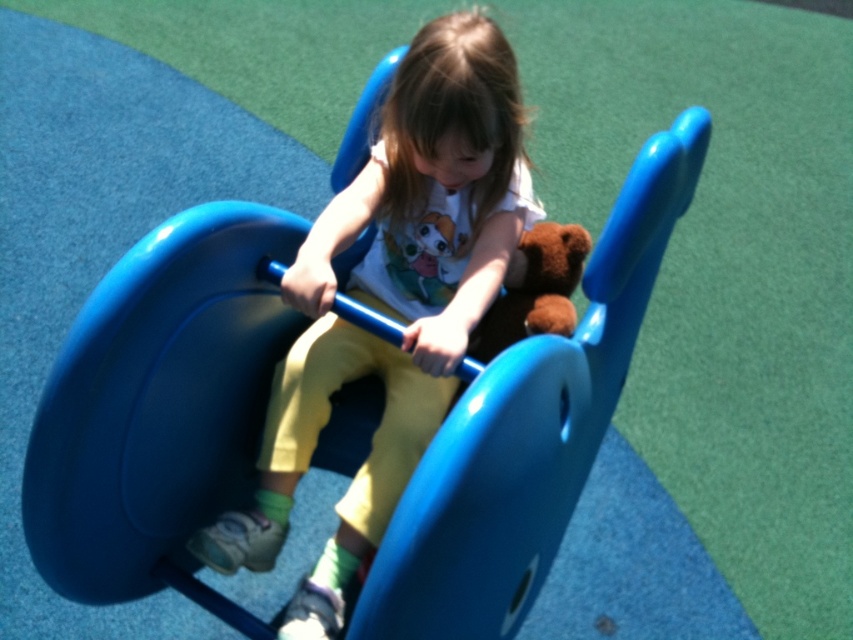
Between matte plastic child at center and brown plush at center, which one is positioned lower?

Positioned lower is matte plastic child at center.

Does matte plastic child at center appear under brown plush at center?

Yes.

Is point (368, 506) behind point (563, 248)?

No, (368, 506) is in front of (563, 248).

Find the location of a particular element. Image resolution: width=853 pixels, height=640 pixels. matte plastic child at center is located at coordinates (392, 300).

Between point (456, 616) and point (486, 145), which one is positioned in front?

Point (456, 616) is in front.

Can you confirm if blue glossy slide at center is positioned to the right of matte plastic child at center?

Yes, blue glossy slide at center is to the right of matte plastic child at center.

Which is behind, point (148, 579) or point (294, 602)?

Point (148, 579)

The width and height of the screenshot is (853, 640). I want to click on blue glossy slide at center, so click(158, 406).

Does blue glossy slide at center have a larger size compared to brown plush at center?

Yes.

Is blue glossy slide at center to the right of brown plush at center from the viewer's perspective?

Yes, blue glossy slide at center is to the right of brown plush at center.

Locate an element on the screen. blue glossy slide at center is located at coordinates pyautogui.click(x=158, y=406).